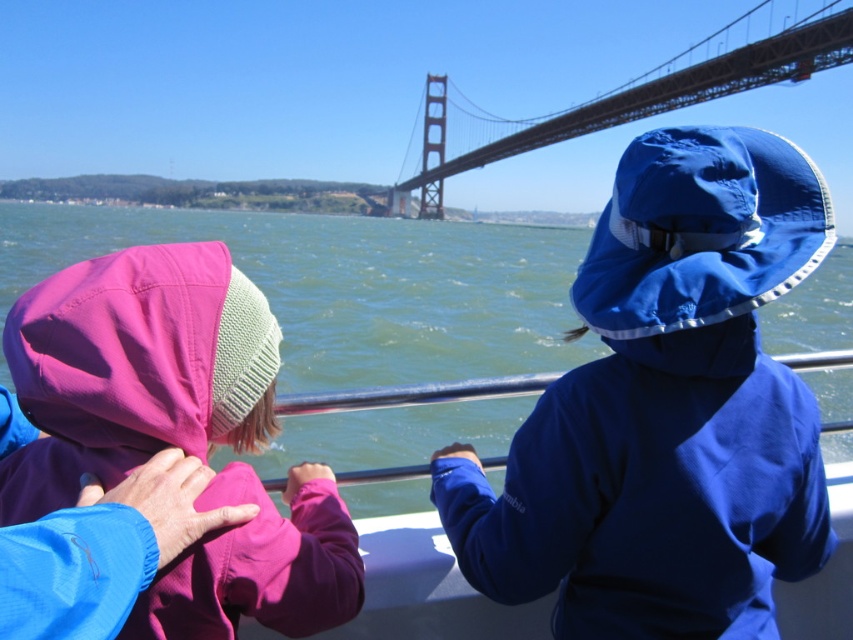
Does point (294, 433) come closer to viewer compared to point (755, 44)?

Yes, point (294, 433) is in front of point (755, 44).

Identify the location of green water at center. (349, 285).

Where is `green water at center`? The image size is (853, 640). green water at center is located at coordinates (349, 285).

Consider the image. Does blue matte sun hat at upper right have a lesser width compared to metallic bridge at upper center?

Indeed, blue matte sun hat at upper right has a lesser width compared to metallic bridge at upper center.

Is blue matte sun hat at upper right to the right of metallic bridge at upper center from the viewer's perspective?

No, blue matte sun hat at upper right is not to the right of metallic bridge at upper center.

What do you see at coordinates (666, 410) in the screenshot? The height and width of the screenshot is (640, 853). I see `blue matte sun hat at upper right` at bounding box center [666, 410].

At what (x,y) coordinates should I click in order to perform the action: click on blue matte sun hat at upper right. Please return your answer as a coordinate pair (x, y). Looking at the image, I should click on (666, 410).

Who is more forward, (x=775, y=573) or (x=590, y=348)?

Positioned in front is point (x=775, y=573).

Is blue matte sun hat at upper right smaller than green water at center?

Correct, blue matte sun hat at upper right occupies less space than green water at center.

This screenshot has height=640, width=853. In order to click on blue matte sun hat at upper right in this screenshot , I will do `click(666, 410)`.

Locate an element on the screen. This screenshot has height=640, width=853. blue matte sun hat at upper right is located at coordinates (666, 410).